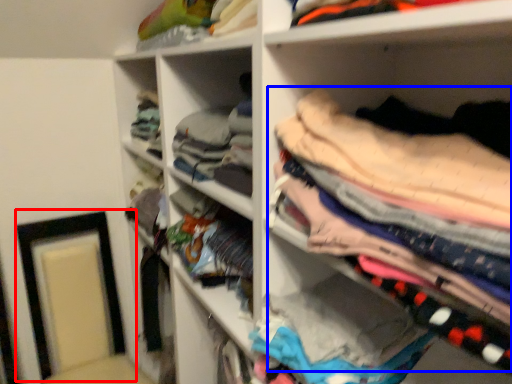
Question: Which object appears farthest to the camera in this image, picture frame (highlighted by a red box) or clothing (highlighted by a blue box)?

Choices:
 (A) picture frame
 (B) clothing

Answer: (A)